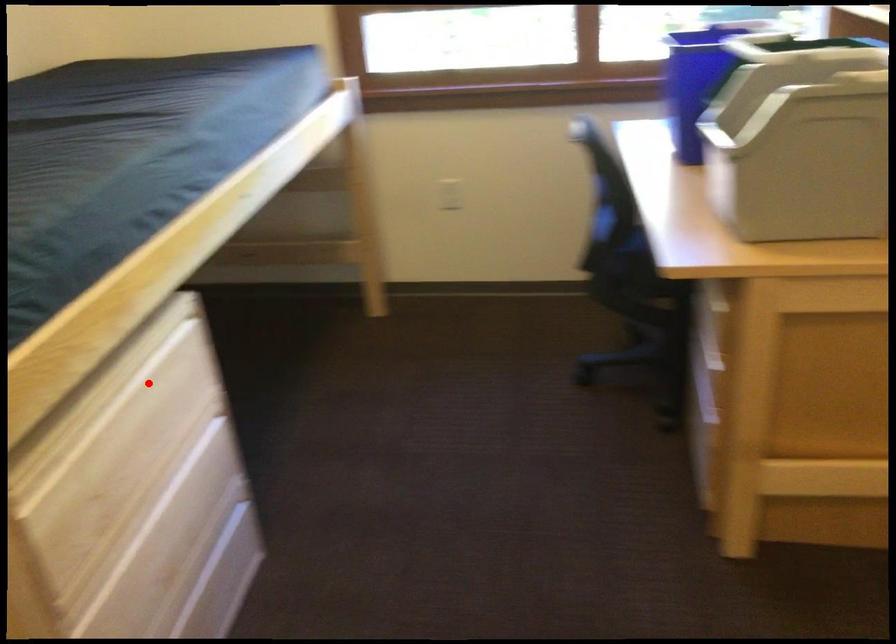
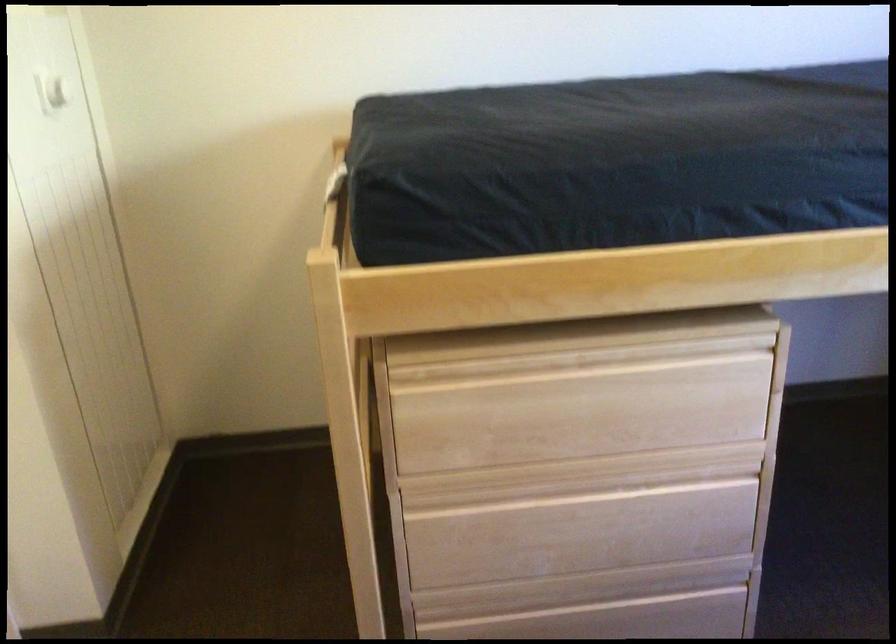
Where in the second image is the point corresponding to the highlighted location from the first image?

(642, 377)